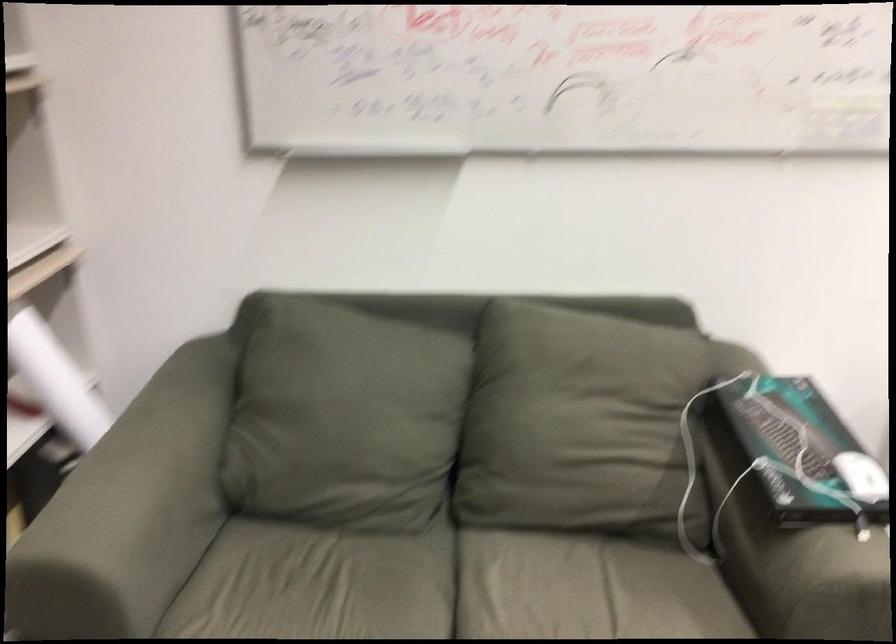
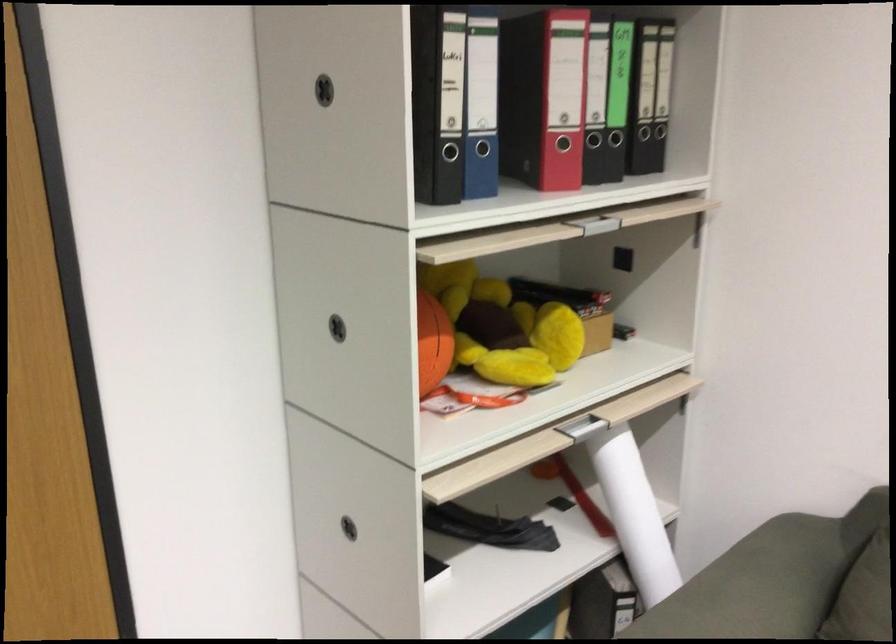
In the second image, find the point that corresponds to point 100,146 in the first image.

(743, 260)